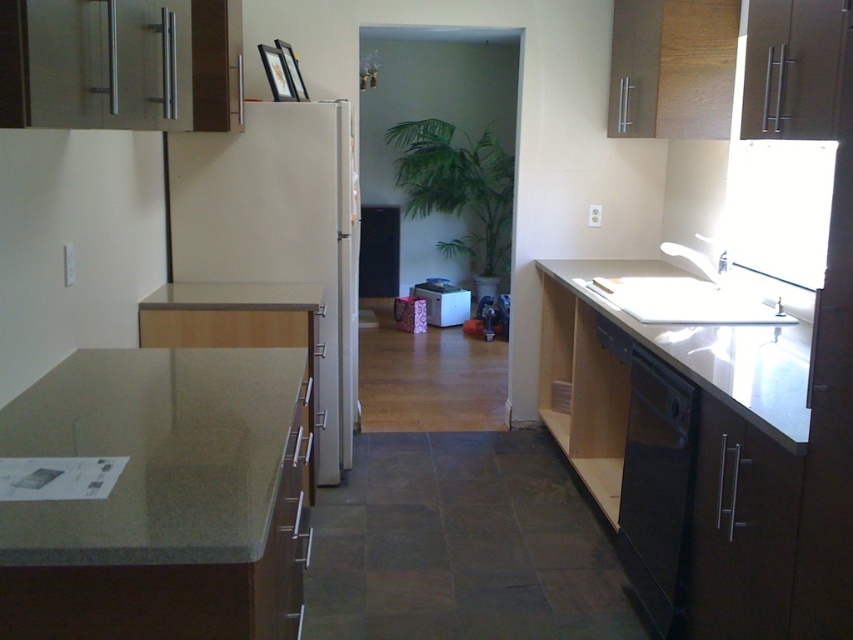
Is white glossy countertop at right to the right of white plastic microwave at center from the viewer's perspective?

Correct, you'll find white glossy countertop at right to the right of white plastic microwave at center.

Does white glossy countertop at right appear on the left side of white plastic microwave at center?

No, white glossy countertop at right is not to the left of white plastic microwave at center.

At what (x,y) coordinates should I click in order to perform the action: click on white glossy countertop at right. Please return your answer as a coordinate pair (x, y). Looking at the image, I should click on (706, 349).

Who is positioned more to the left, black matte dishwasher at lower right or white glossy countertop at right?

black matte dishwasher at lower right

Is black matte dishwasher at lower right positioned at the back of white glossy countertop at right?

Yes, black matte dishwasher at lower right is further from the viewer.

Where is `black matte dishwasher at lower right`? black matte dishwasher at lower right is located at coordinates (657, 488).

Locate an element on the screen. black matte dishwasher at lower right is located at coordinates (657, 488).

Can you confirm if white glossy refrigerator at center is positioned to the right of white glossy countertop at right?

Incorrect, white glossy refrigerator at center is not on the right side of white glossy countertop at right.

Is white glossy refrigerator at center above white glossy countertop at right?

Correct, white glossy refrigerator at center is located above white glossy countertop at right.

Who is more distant from viewer, (332, 141) or (793, 403)?

The point (332, 141) is more distant.

This screenshot has height=640, width=853. What are the coordinates of `white glossy refrigerator at center` in the screenshot? It's located at (280, 232).